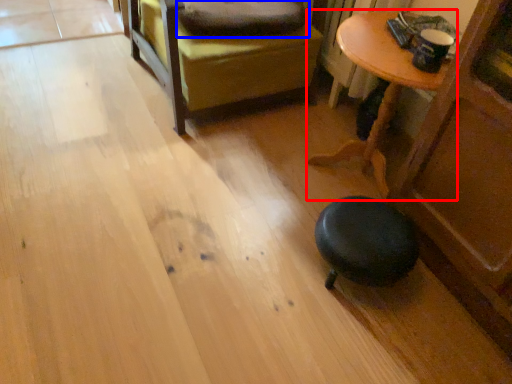
Question: Among these objects, which one is farthest to the camera, table (highlighted by a red box) or pillow (highlighted by a blue box)?

Choices:
 (A) table
 (B) pillow

Answer: (B)